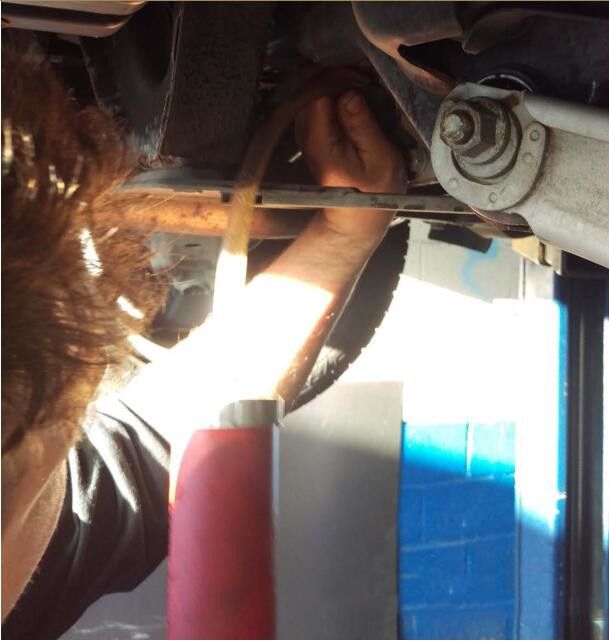
What are the coordinates of `blue tile` in the screenshot? It's located at (466, 483).